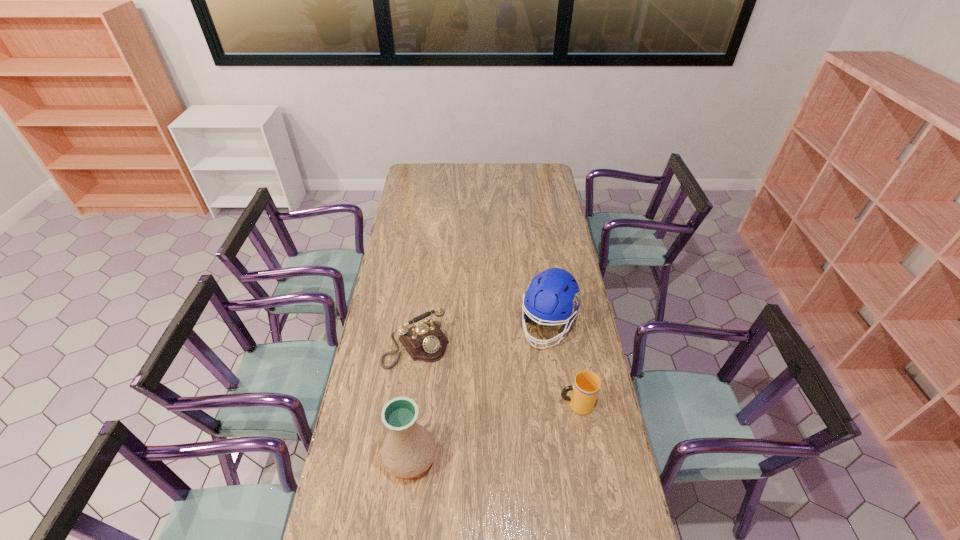
The image size is (960, 540). In order to click on vacant space located 0.390m on the dial of the telephone in this screenshot , I will do `click(490, 446)`.

You are a GUI agent. You are given a task and a screenshot of the screen. Output one action in this format:
    pyautogui.click(x=<x>, y=<y>)
    Task: Click on the vacant position located 0.380m on the front-facing side of the football helmet
    
    Given the screenshot: What is the action you would take?
    pyautogui.click(x=503, y=433)

What are the coordinates of `free location located 0.130m on the front-facing side of the football helmet` in the screenshot? It's located at (528, 376).

Image resolution: width=960 pixels, height=540 pixels. What are the coordinates of `free region located 0.110m on the front-facing side of the football helmet` in the screenshot? It's located at (530, 373).

At what (x,y) coordinates should I click in order to perform the action: click on pottery situated at the left edge. Please return your answer as a coordinate pair (x, y). This screenshot has height=540, width=960. Looking at the image, I should click on (408, 451).

The height and width of the screenshot is (540, 960). Find the location of `telephone that is at the left edge`. telephone that is at the left edge is located at coordinates (424, 341).

Locate an element on the screen. cup that is at the right edge is located at coordinates (584, 391).

The height and width of the screenshot is (540, 960). I want to click on football helmet that is at the right edge, so click(553, 296).

The image size is (960, 540). What are the coordinates of `vacant space at the far edge of the desktop` in the screenshot? It's located at (487, 173).

In the image, there is a desktop. Find the location of `free space at the near edge`. free space at the near edge is located at coordinates (475, 519).